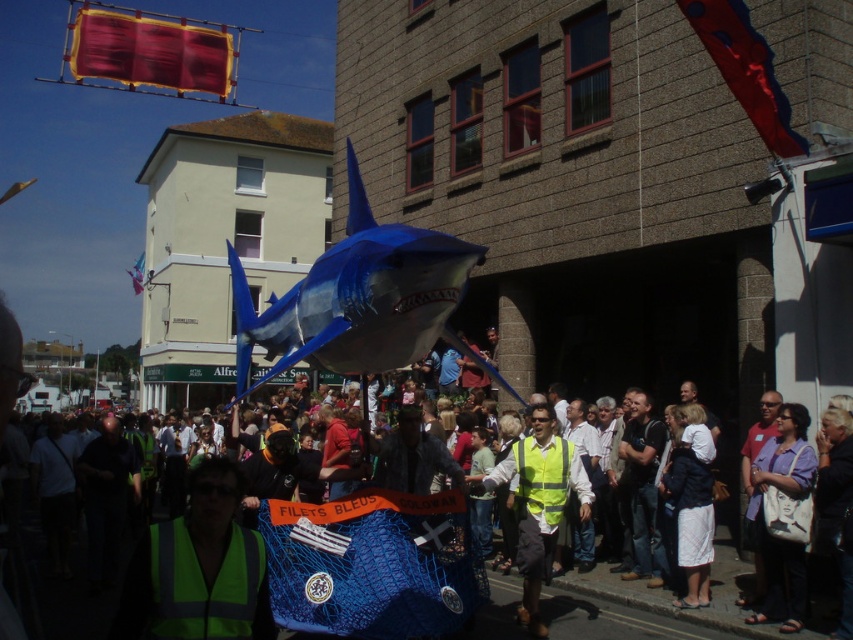
Question: Among these points, which one is farthest from the camera?

Choices:
 (A) (776, 429)
 (B) (398, 326)

Answer: (A)

Question: Which point is closer to the camera?

Choices:
 (A) [x=535, y=577]
 (B) [x=706, y=465]
 (C) [x=225, y=476]

Answer: (C)

Question: Can you confirm if matte purple shirt at center is wider than white cotton dress at lower right?

Choices:
 (A) yes
 (B) no

Answer: (B)

Question: Does shiny blue shark at center appear on the right side of green reflective vest at center?

Choices:
 (A) yes
 (B) no

Answer: (B)

Question: Can you confirm if shiny blue shark at center is positioned below white cotton dress at lower right?

Choices:
 (A) no
 (B) yes

Answer: (A)

Question: Which point appears farthest from the camera in this image?

Choices:
 (A) (334, 356)
 (B) (148, 596)
 (C) (804, 419)
 (D) (683, 417)

Answer: (D)